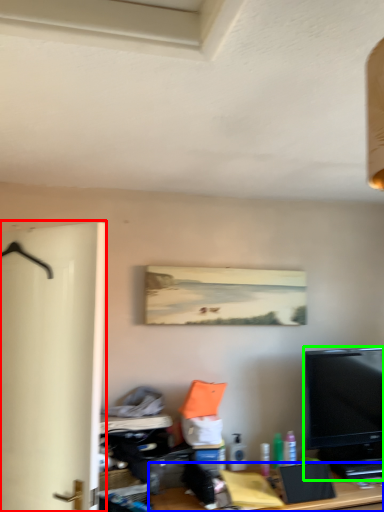
Question: Estimate the real-world distances between objects in this image. Which object is closer to door (highlighted by a red box), desk (highlighted by a blue box) or television (highlighted by a green box)?

Choices:
 (A) desk
 (B) television

Answer: (A)